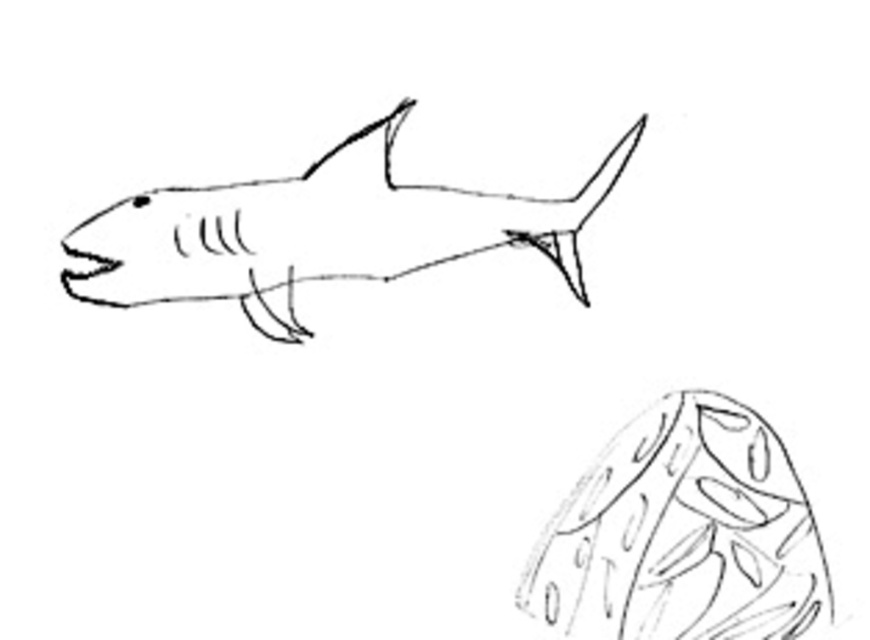
Question: Which point is closer to the camera?

Choices:
 (A) (130, 273)
 (B) (696, 401)

Answer: (A)

Question: Does black line shark at upper center have a smaller size compared to smooth gray fish at upper center?

Choices:
 (A) no
 (B) yes

Answer: (A)

Question: Which point appears farthest from the camera in this image?

Choices:
 (A) (586, 593)
 (B) (253, 289)

Answer: (B)

Question: Is black line shark at upper center above smooth gray fish at upper center?

Choices:
 (A) yes
 (B) no

Answer: (A)

Question: Is black line shark at upper center further to camera compared to smooth gray fish at upper center?

Choices:
 (A) yes
 (B) no

Answer: (A)